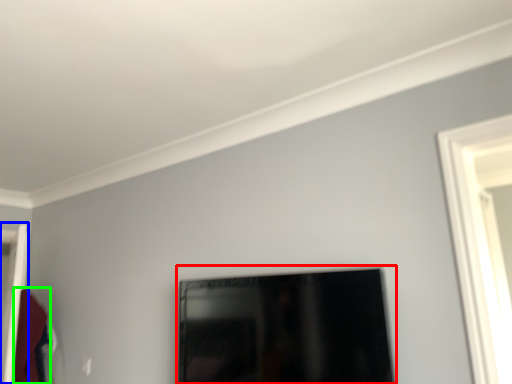
Question: Considering the real-world distances, which object is farthest from picture frame (highlighted by a red box)? door (highlighted by a blue box) or robe (highlighted by a green box)?

Choices:
 (A) door
 (B) robe

Answer: (A)